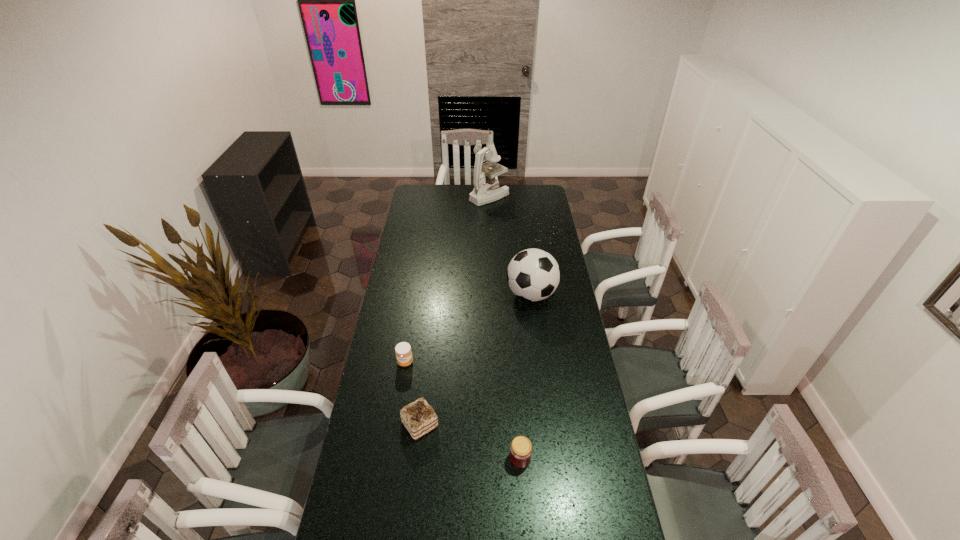
Locate an element on the screen. The width and height of the screenshot is (960, 540). free location that satisfies the following two spatial constraints: 1. on the back side of the tallest object; 2. on the right side of the chocolate cake is located at coordinates [445, 196].

Locate an element on the screen. The width and height of the screenshot is (960, 540). vacant space that satisfies the following two spatial constraints: 1. on the front side of the microscope; 2. on the left side of the nearer jam is located at coordinates (497, 458).